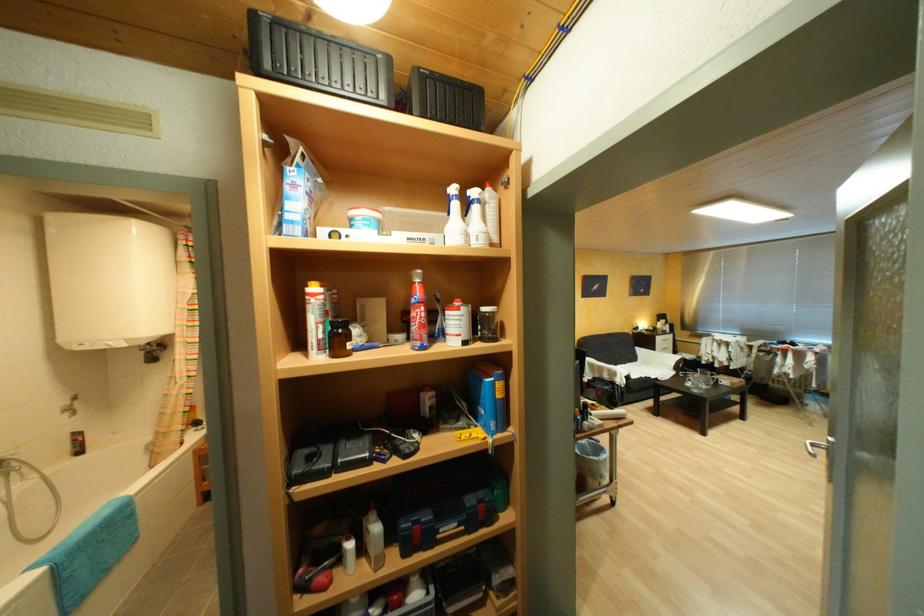
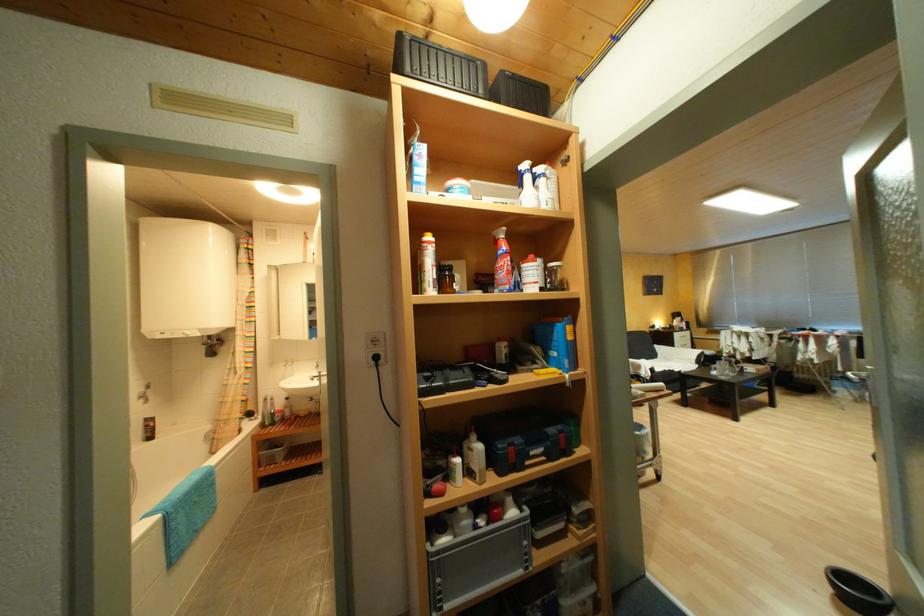
Where in the second image is the point corresponding to the point at 675,256 from the first image?

(685, 256)